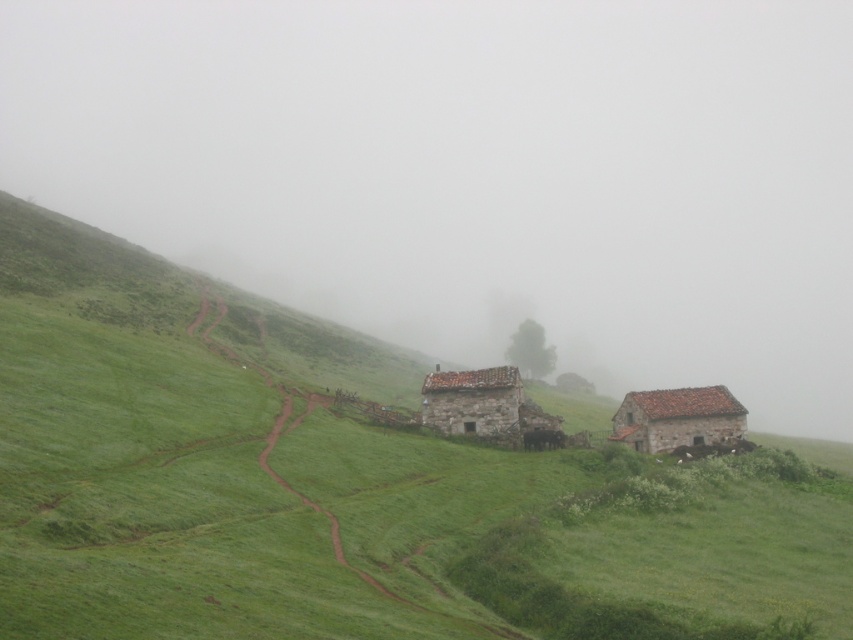
You are an artist wanting to capture the scene of the foggy mist at center and the rustic stone hut at center. Based on their positions, which object should you focus on first if you are moving from the left side of the image to the right?

The foggy mist at center is to the left of rustic stone hut at center, so you should focus on the foggy mist at center first as you move from left to right.